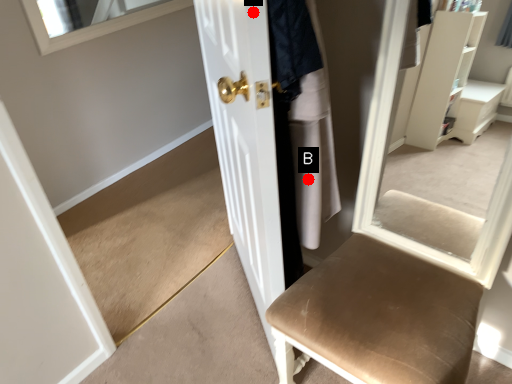
Question: Two points are circled on the image, labeled by A and B beside each circle. Which point is farther to the camera?

Choices:
 (A) A is further
 (B) B is further

Answer: (B)